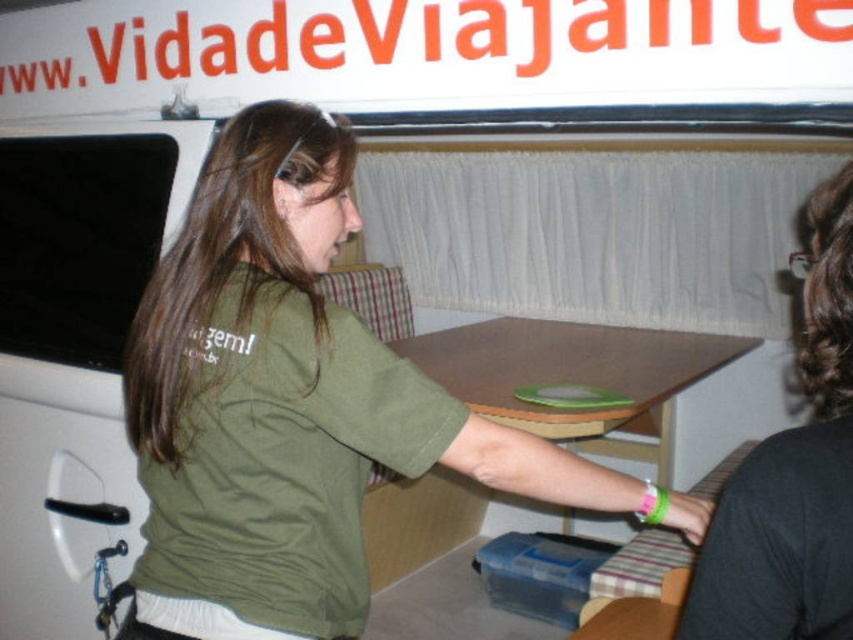
In the scene shown: You are a passenger on a bus and want to place a small backpack on the nearest surface. You see a black matte shirt at upper right and a brown wooden table at center. Which surface is closer to you where you can place your backpack?

The black matte shirt at upper right is closer to the viewer than the brown wooden table at center, so you should place your backpack on the black matte shirt at upper right.